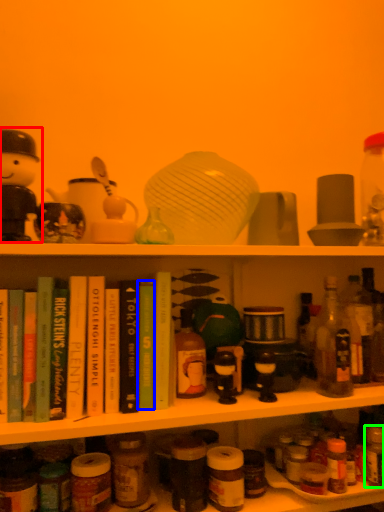
Question: Which is farther away from toy (highlighted by a red box)? book (highlighted by a blue box) or bottle (highlighted by a green box)?

Choices:
 (A) book
 (B) bottle

Answer: (B)